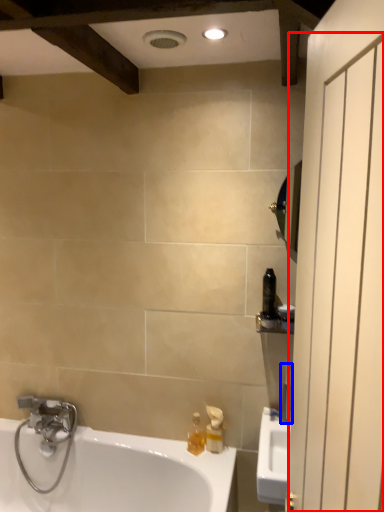
Question: Which object is further to the camera taking this photo, screen door (highlighted by a red box) or toiletry (highlighted by a blue box)?

Choices:
 (A) screen door
 (B) toiletry

Answer: (B)